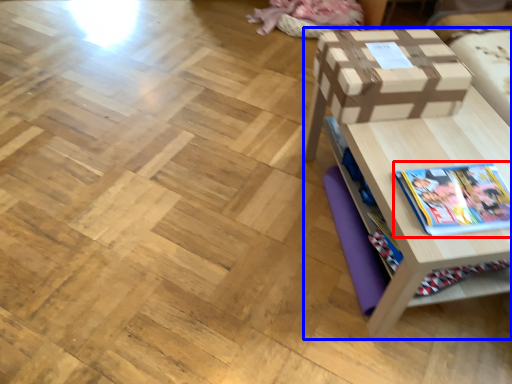
Question: Which object appears farthest to the camera in this image, book (highlighted by a red box) or table (highlighted by a blue box)?

Choices:
 (A) book
 (B) table

Answer: (A)